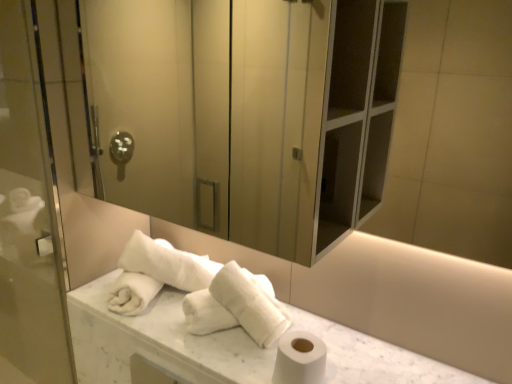
Image resolution: width=512 pixels, height=384 pixels. What are the coordinates of `vacant area in front of white soft towel at center, which ranks as the 1th bath towel in left-to-right order` in the screenshot? It's located at (163, 325).